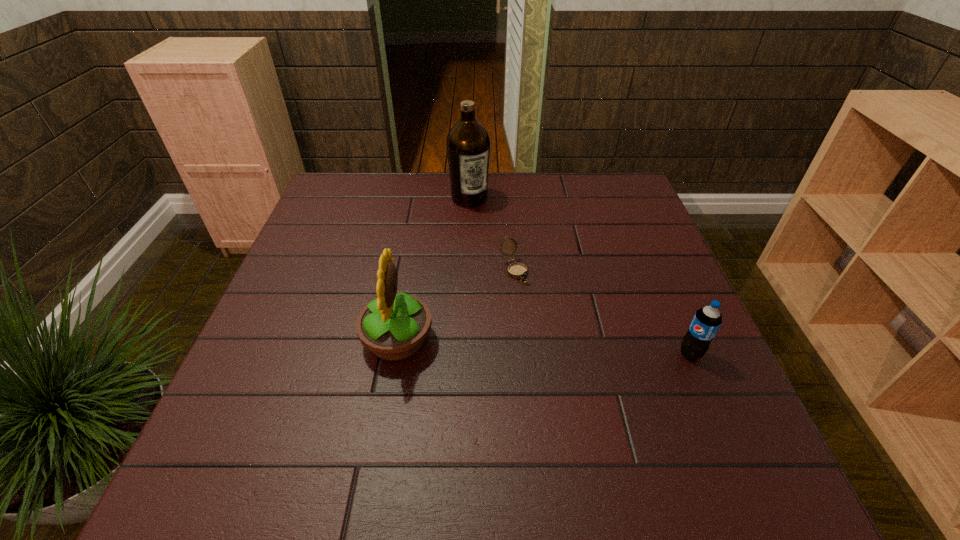
Locate an element on the screen. vacant position located on the label of the olive oil is located at coordinates (522, 283).

You are a GUI agent. You are given a task and a screenshot of the screen. Output one action in this format:
    pyautogui.click(x=<x>, y=<y>)
    Task: Click on the vacant space located 0.260m on the label of the olive oil
    The width and height of the screenshot is (960, 540).
    Given the screenshot: What is the action you would take?
    pyautogui.click(x=510, y=262)

Locate an element on the screen. This screenshot has height=540, width=960. vacant space located on the label of the olive oil is located at coordinates (491, 232).

Locate an element on the screen. This screenshot has width=960, height=540. free point located 0.160m on the face of the compass is located at coordinates (553, 330).

The height and width of the screenshot is (540, 960). I want to click on free space located on the face of the compass, so click(538, 309).

The height and width of the screenshot is (540, 960). In order to click on blank area located on the face of the compass in this screenshot , I will do `click(614, 418)`.

At what (x,y) coordinates should I click in order to perform the action: click on object that is at the far edge. Please return your answer as a coordinate pair (x, y). Looking at the image, I should click on (468, 143).

The height and width of the screenshot is (540, 960). Identify the location of object that is at the right edge. (706, 322).

Locate an element on the screen. This screenshot has width=960, height=540. free region at the far edge of the desktop is located at coordinates (435, 181).

This screenshot has width=960, height=540. I want to click on vacant space at the near edge of the desktop, so click(627, 435).